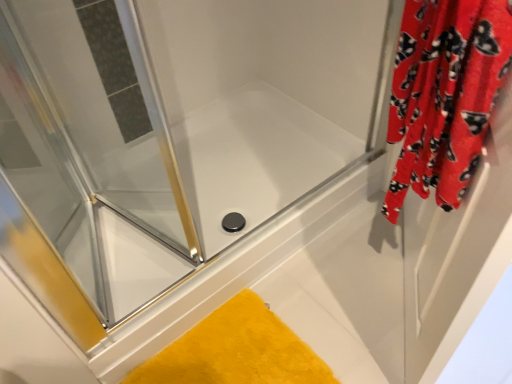
Question: Is clear glass shower door at upper left, arranged as the second screen door when viewed from the right, closer to camera compared to yellow plush bath mat at lower center?

Choices:
 (A) no
 (B) yes

Answer: (B)

Question: Are clear glass shower door at upper left, the 1th screen door in the left-to-right sequence, and yellow plush bath mat at lower center beside each other?

Choices:
 (A) no
 (B) yes

Answer: (A)

Question: From the image's perspective, does clear glass shower door at upper left, the 1th screen door in the left-to-right sequence, appear higher than yellow plush bath mat at lower center?

Choices:
 (A) yes
 (B) no

Answer: (A)

Question: Can you confirm if clear glass shower door at upper left, the 1th screen door in the left-to-right sequence, is bigger than yellow plush bath mat at lower center?

Choices:
 (A) yes
 (B) no

Answer: (A)

Question: Does clear glass shower door at upper left, arranged as the second screen door when viewed from the right, have a greater height compared to yellow plush bath mat at lower center?

Choices:
 (A) no
 (B) yes

Answer: (B)

Question: In terms of height, does red fabric curtain at right, acting as the first screen door starting from the right, look taller or shorter compared to red velvet curtain at right?

Choices:
 (A) tall
 (B) short

Answer: (A)

Question: Visually, is red fabric curtain at right, acting as the first screen door starting from the right, positioned to the left or to the right of red velvet curtain at right?

Choices:
 (A) right
 (B) left

Answer: (A)

Question: Is red fabric curtain at right, the 2th screen door when ordered from left to right, inside or outside of red velvet curtain at right?

Choices:
 (A) inside
 (B) outside

Answer: (B)

Question: Relative to red velvet curtain at right, is red fabric curtain at right, the 2th screen door when ordered from left to right, in front or behind?

Choices:
 (A) behind
 (B) front

Answer: (A)

Question: Is clear glass shower door at upper left, arranged as the second screen door when viewed from the right, bigger or smaller than red velvet curtain at right?

Choices:
 (A) big
 (B) small

Answer: (B)

Question: From a real-world perspective, is clear glass shower door at upper left, arranged as the second screen door when viewed from the right, above or below red velvet curtain at right?

Choices:
 (A) below
 (B) above

Answer: (A)

Question: Is clear glass shower door at upper left, the 1th screen door in the left-to-right sequence, to the left or to the right of red velvet curtain at right in the image?

Choices:
 (A) left
 (B) right

Answer: (A)

Question: Is clear glass shower door at upper left, the 1th screen door in the left-to-right sequence, taller or shorter than red velvet curtain at right?

Choices:
 (A) short
 (B) tall

Answer: (B)

Question: Visually, is red velvet curtain at right positioned to the left or to the right of yellow plush bath mat at lower center?

Choices:
 (A) right
 (B) left

Answer: (A)

Question: In terms of height, does red velvet curtain at right look taller or shorter compared to yellow plush bath mat at lower center?

Choices:
 (A) short
 (B) tall

Answer: (B)